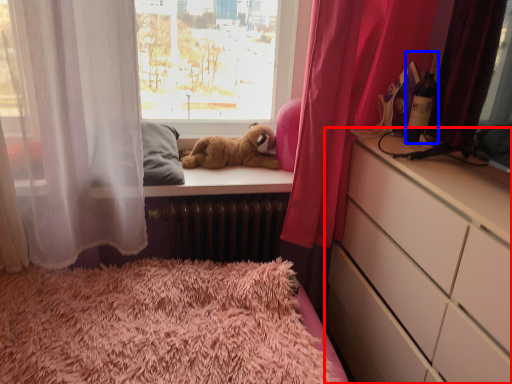
Question: Among these objects, which one is nearest to the camera, chest of drawers (highlighted by a red box) or bottle (highlighted by a blue box)?

Choices:
 (A) chest of drawers
 (B) bottle

Answer: (A)